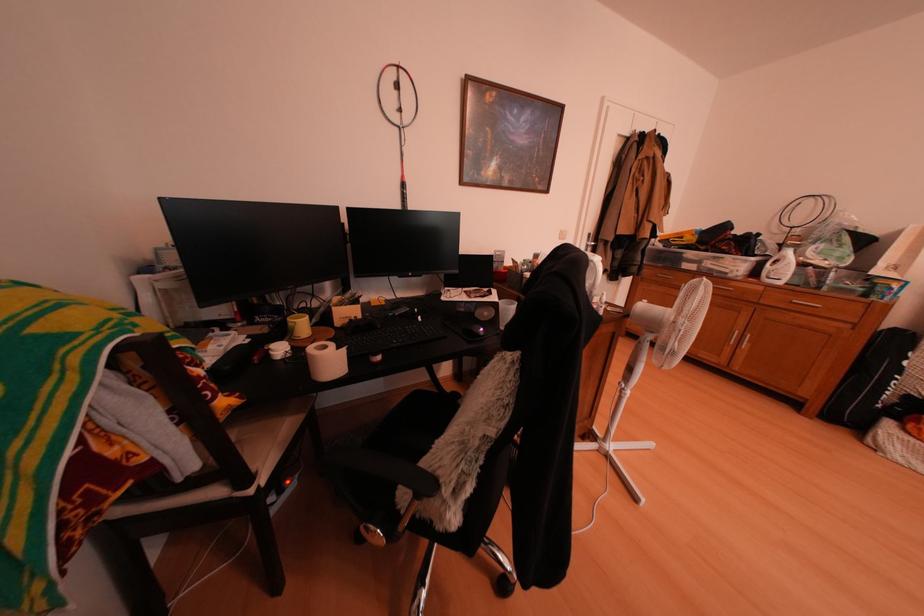
Where is `silver cabinet handle`? This screenshot has width=924, height=616. silver cabinet handle is located at coordinates (805, 302).